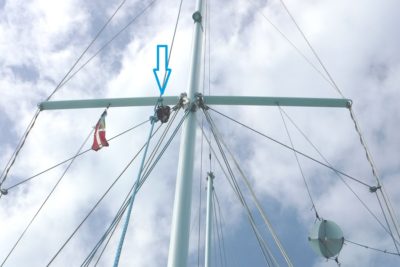
This screenshot has height=267, width=400. I want to click on cords, so click(x=294, y=19).